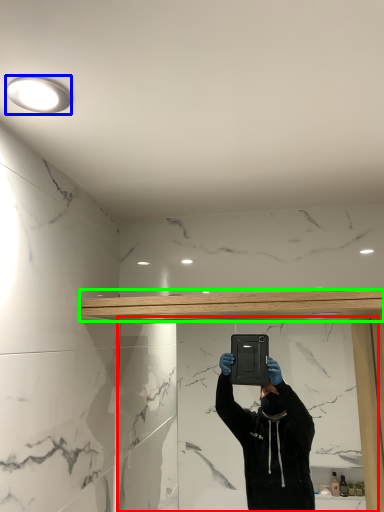
Question: Considering the real-world distances, which object is closest to mirror (highlighted by a red box)? light fixture (highlighted by a blue box) or beam (highlighted by a green box).

Choices:
 (A) light fixture
 (B) beam

Answer: (B)